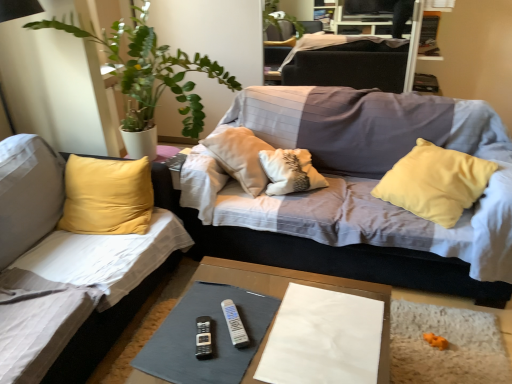
At what (x,y) coordinates should I click in order to perform the action: click on vacant space that is in between white plastic remote at center, which is counted as the second remote, starting from the left, and black plastic remote at center, the 1th remote in the left-to-right sequence. Please return your answer as a coordinate pair (x, y). The width and height of the screenshot is (512, 384). Looking at the image, I should click on (218, 336).